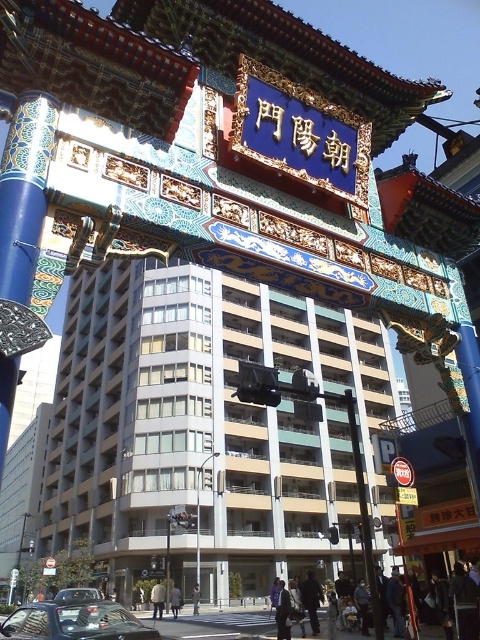
Question: Observing the image, what is the correct spatial positioning of black glossy car at lower left in reference to matte black car at lower left?

Choices:
 (A) above
 (B) below

Answer: (A)

Question: Is black glossy car at lower left to the left of matte black car at lower left from the viewer's perspective?

Choices:
 (A) yes
 (B) no

Answer: (B)

Question: Which object appears farthest from the camera in this image?

Choices:
 (A) black glossy car at lower left
 (B) matte black car at lower left

Answer: (B)

Question: Which point appears closest to the camera in this image?

Choices:
 (A) (87, 588)
 (B) (100, 637)

Answer: (B)

Question: Is black glossy car at lower left closer to camera compared to matte black car at lower left?

Choices:
 (A) yes
 (B) no

Answer: (A)